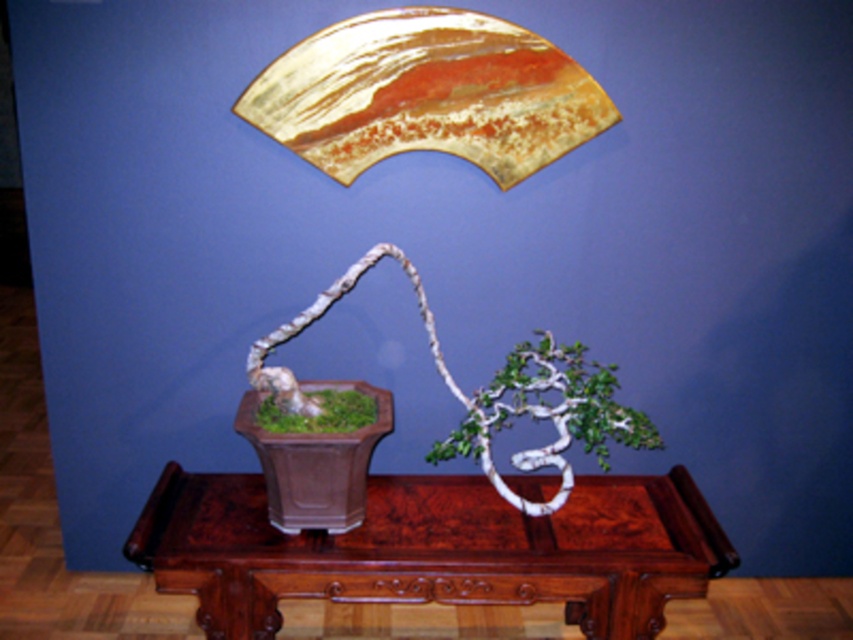
Question: Can you confirm if brown polished wood table at center is wider than green matte bonsai at center?

Choices:
 (A) yes
 (B) no

Answer: (A)

Question: Which point is closer to the camera?

Choices:
 (A) brown polished wood table at center
 (B) green matte bonsai at center

Answer: (A)

Question: Is brown polished wood table at center positioned in front of green matte bonsai at center?

Choices:
 (A) no
 (B) yes

Answer: (B)

Question: Which point is farther to the camera?

Choices:
 (A) (141, 554)
 (B) (323, 426)

Answer: (B)

Question: Does brown polished wood table at center lie in front of green matte bonsai at center?

Choices:
 (A) yes
 (B) no

Answer: (A)